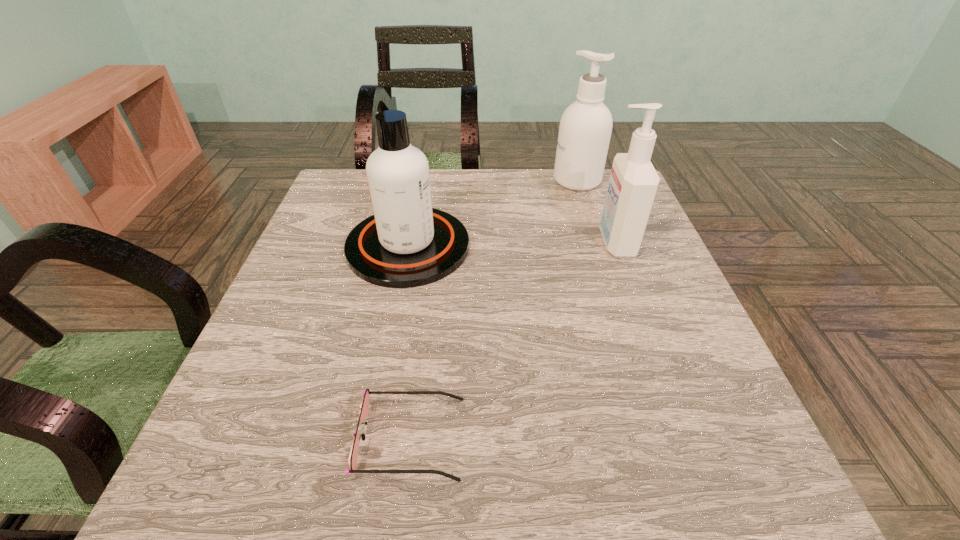
Locate an element on the screen. The image size is (960, 540). the farthest cleansing agent is located at coordinates (585, 128).

What are the coordinates of `the leftmost cleansing agent` in the screenshot? It's located at tap(406, 243).

Find the location of `the shortest object`. the shortest object is located at coordinates (364, 407).

In order to click on sunglasses in this screenshot , I will do `click(364, 407)`.

The height and width of the screenshot is (540, 960). In order to click on vacant space located 0.180m on the front label of the farthest cleansing agent in this screenshot , I will do `click(490, 180)`.

I want to click on free space located 0.150m on the front label of the farthest cleansing agent, so click(x=500, y=180).

Locate an element on the screen. The height and width of the screenshot is (540, 960). free space located on the front label of the farthest cleansing agent is located at coordinates pyautogui.click(x=504, y=180).

The image size is (960, 540). I want to click on vacant space located on the back of the leftmost cleansing agent, so click(417, 202).

The width and height of the screenshot is (960, 540). Find the location of `vacant space located 0.270m on the bridge of the sunglasses`. vacant space located 0.270m on the bridge of the sunglasses is located at coordinates (639, 438).

Locate an element on the screen. The image size is (960, 540). object located at the near edge is located at coordinates (364, 407).